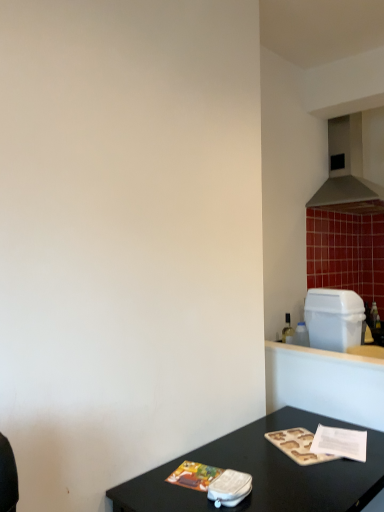
The image size is (384, 512). Identify the location of black glossy table at lower right. (264, 473).

Where is `metallic gray exhaust hood at upper right`? The width and height of the screenshot is (384, 512). metallic gray exhaust hood at upper right is located at coordinates tap(354, 164).

This screenshot has height=512, width=384. Identify the location of white plastic trash can at right. 333,318.

From the picture: Could you tell me if black glossy table at lower right is facing metallic gray exhaust hood at upper right?

No.

What's the angular difference between black glossy table at lower right and metallic gray exhaust hood at upper right's facing directions?

There is a 0.000936-degree angle between the facing directions of black glossy table at lower right and metallic gray exhaust hood at upper right.

Between black glossy table at lower right and metallic gray exhaust hood at upper right, which one has smaller width?

metallic gray exhaust hood at upper right.

Is black glossy table at lower right not close to metallic gray exhaust hood at upper right?

black glossy table at lower right is positioned a significant distance from metallic gray exhaust hood at upper right.

I want to click on exhaust hood on the right side of white plastic trash can at right, so click(354, 164).

From the image's perspective, is metallic gray exhaust hood at upper right below white plastic trash can at right?

No, from the image's perspective, metallic gray exhaust hood at upper right is not beneath white plastic trash can at right.

Does metallic gray exhaust hood at upper right have a greater width compared to white plastic trash can at right?

Yes.

Based on the photo, from the image's perspective, is metallic gray exhaust hood at upper right located above or below black glossy table at lower right?

metallic gray exhaust hood at upper right is above black glossy table at lower right.

Is metallic gray exhaust hood at upper right facing away from black glossy table at lower right?

metallic gray exhaust hood at upper right is not turned away from black glossy table at lower right.

Is metallic gray exhaust hood at upper right not near black glossy table at lower right?

That's right, there is a large distance between metallic gray exhaust hood at upper right and black glossy table at lower right.

From the picture: Is metallic gray exhaust hood at upper right not inside black glossy table at lower right?

That's correct, metallic gray exhaust hood at upper right is outside of black glossy table at lower right.

Considering the positions of point (327, 346) and point (356, 178), is point (327, 346) closer or farther from the camera than point (356, 178)?

Point (327, 346) appears to be closer to the viewer than point (356, 178).

Is white plastic trash can at right placed right next to metallic gray exhaust hood at upper right?

white plastic trash can at right and metallic gray exhaust hood at upper right are clearly separated.

Where is `appliance beneath the metallic gray exhaust hood at upper right (from a real-world perspective)`? Image resolution: width=384 pixels, height=512 pixels. appliance beneath the metallic gray exhaust hood at upper right (from a real-world perspective) is located at coordinates (333, 318).

From the picture: Does white plastic trash can at right have a greater width compared to metallic gray exhaust hood at upper right?

In fact, white plastic trash can at right might be narrower than metallic gray exhaust hood at upper right.

Does black glossy table at lower right have a greater width compared to white plastic trash can at right?

Correct, the width of black glossy table at lower right exceeds that of white plastic trash can at right.

From the image's perspective, which is above, black glossy table at lower right or white plastic trash can at right?

white plastic trash can at right, from the image's perspective.

Can you confirm if black glossy table at lower right is positioned to the left of white plastic trash can at right?

Yes, black glossy table at lower right is to the left of white plastic trash can at right.

Can you confirm if white plastic trash can at right is positioned to the left of black glossy table at lower right?

No.

From the image's perspective, is white plastic trash can at right on black glossy table at lower right?

Indeed, from the image's perspective, white plastic trash can at right is shown above black glossy table at lower right.

Is the depth of white plastic trash can at right greater than that of black glossy table at lower right?

Yes, white plastic trash can at right is further from the viewer.

Is white plastic trash can at right positioned far away from black glossy table at lower right?

No.

The height and width of the screenshot is (512, 384). Find the location of `exhaust hood above the black glossy table at lower right (from the image's perspective)`. exhaust hood above the black glossy table at lower right (from the image's perspective) is located at coordinates (354, 164).

This screenshot has height=512, width=384. In order to click on exhaust hood that appears on the right of white plastic trash can at right in this screenshot , I will do `click(354, 164)`.

Based on their spatial positions, is metallic gray exhaust hood at upper right or black glossy table at lower right further from white plastic trash can at right?

metallic gray exhaust hood at upper right is positioned further to the anchor white plastic trash can at right.

When comparing their distances from black glossy table at lower right, does metallic gray exhaust hood at upper right or white plastic trash can at right seem closer?

white plastic trash can at right.

When comparing their distances from metallic gray exhaust hood at upper right, does black glossy table at lower right or white plastic trash can at right seem closer?

white plastic trash can at right lies closer to metallic gray exhaust hood at upper right than the other object.

Looking at the image, which one is located further to metallic gray exhaust hood at upper right, white plastic trash can at right or black glossy table at lower right?

Based on the image, black glossy table at lower right appears to be further to metallic gray exhaust hood at upper right.

From the image, which object appears to be farther from black glossy table at lower right, white plastic trash can at right or metallic gray exhaust hood at upper right?

metallic gray exhaust hood at upper right.

Which object lies further to the anchor point white plastic trash can at right, black glossy table at lower right or metallic gray exhaust hood at upper right?

metallic gray exhaust hood at upper right is positioned further to the anchor white plastic trash can at right.

At what (x,y) coordinates should I click in order to perform the action: click on appliance between metallic gray exhaust hood at upper right and black glossy table at lower right in the up-down direction. Please return your answer as a coordinate pair (x, y). The height and width of the screenshot is (512, 384). Looking at the image, I should click on point(333,318).